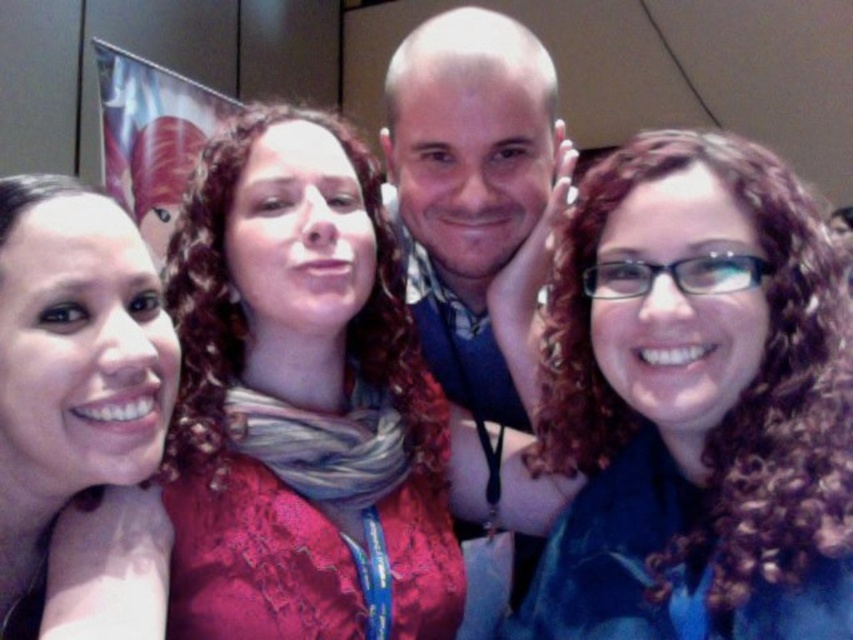
Question: Which point is closer to the camera?

Choices:
 (A) click(x=259, y=282)
 (B) click(x=445, y=113)
 (C) click(x=107, y=234)

Answer: (C)

Question: Does matte blue scarf at center have a smaller size compared to matte pink scarf at left?

Choices:
 (A) yes
 (B) no

Answer: (B)

Question: Which object is farther from the camera taking this photo?

Choices:
 (A) matte red lace dress at center
 (B) matte pink scarf at left
 (C) smooth skin head at center
 (D) matte blue scarf at center

Answer: (C)

Question: Does matte red lace dress at center have a smaller size compared to smooth skin head at center?

Choices:
 (A) no
 (B) yes

Answer: (A)

Question: Which of the following is the farthest from the observer?

Choices:
 (A) matte red lace dress at center
 (B) smooth skin head at center
 (C) matte blue scarf at center
 (D) matte pink scarf at left

Answer: (B)

Question: Is matte red lace dress at center to the left of matte pink scarf at left from the viewer's perspective?

Choices:
 (A) no
 (B) yes

Answer: (A)